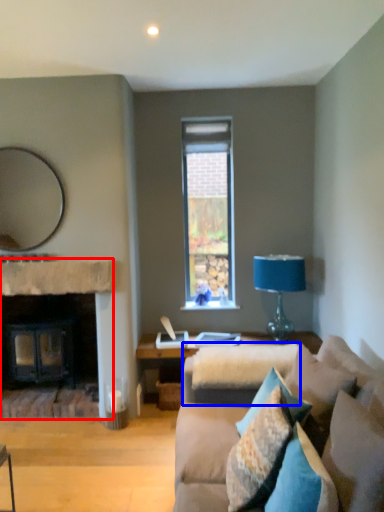
Question: Which of the following is the farthest to the observer, fireplace (highlighted by a red box) or beige (highlighted by a blue box)?

Choices:
 (A) fireplace
 (B) beige

Answer: (A)